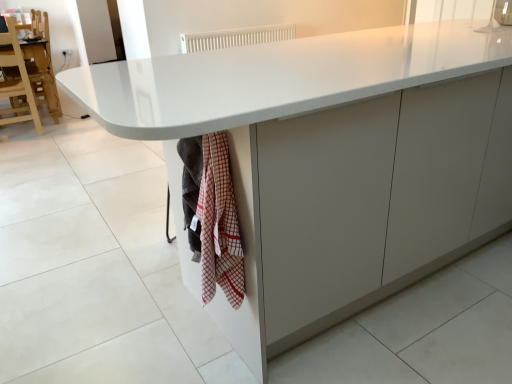
Question: From a real-world perspective, is red checkered towel at lower center above or below white plastic radiator at upper center?

Choices:
 (A) above
 (B) below

Answer: (B)

Question: From their relative heights in the image, would you say red checkered towel at lower center is taller or shorter than white plastic radiator at upper center?

Choices:
 (A) tall
 (B) short

Answer: (A)

Question: Which of these objects is positioned farthest from the wooden chair at left?

Choices:
 (A) red checkered towel at lower center
 (B) white plastic radiator at upper center
 (C) white glossy granite at lower left

Answer: (A)

Question: Based on their relative distances, which object is nearer to the red checkered towel at lower center?

Choices:
 (A) white plastic radiator at upper center
 (B) white glossy granite at lower left
 (C) wooden chair at left

Answer: (B)